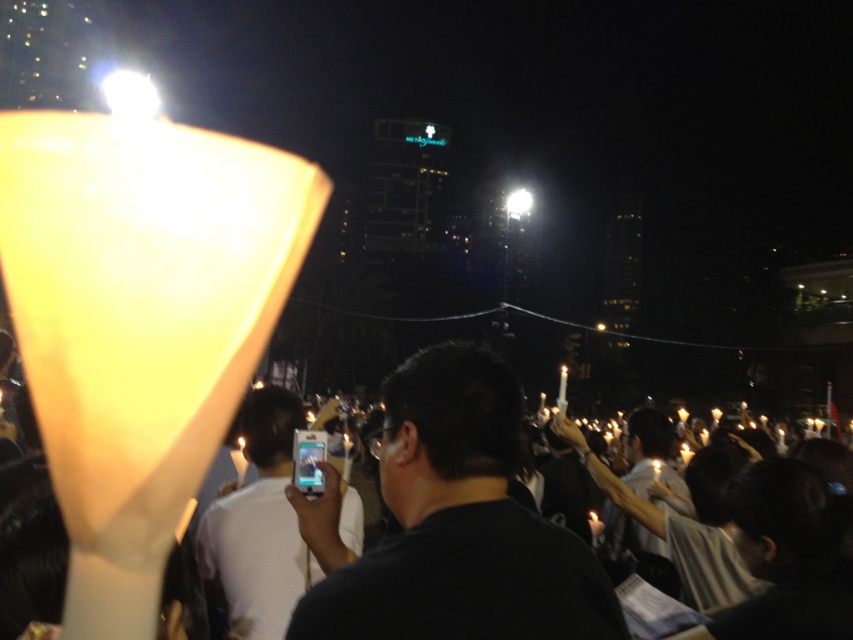
Who is higher up, black matte phone at center or white glossy phone at center?

black matte phone at center is above.

Is point (463, 353) positioned behind point (279, 480)?

No, (463, 353) is in front of (279, 480).

The image size is (853, 640). What do you see at coordinates (451, 524) in the screenshot?
I see `black matte phone at center` at bounding box center [451, 524].

Find the location of a particular element. This screenshot has height=640, width=853. black matte phone at center is located at coordinates (451, 524).

Can you confirm if matte white candle at center is positioned below black matte phone at center?

No, matte white candle at center is not below black matte phone at center.

What do you see at coordinates (459, 524) in the screenshot? I see `matte white candle at center` at bounding box center [459, 524].

Image resolution: width=853 pixels, height=640 pixels. Describe the element at coordinates (459, 524) in the screenshot. I see `matte white candle at center` at that location.

At what (x,y) coordinates should I click in order to perform the action: click on matte white candle at center. Please return your answer as a coordinate pair (x, y). The image size is (853, 640). Looking at the image, I should click on (459, 524).

You are a GUI agent. You are given a task and a screenshot of the screen. Output one action in this format:
    pyautogui.click(x=<x>, y=<y>)
    Task: Click on the matte white candle at center
    
    Given the screenshot: What is the action you would take?
    coord(459,524)

Who is lower down, matte white candle at center or white glossy phone at center?

white glossy phone at center is lower down.

Between point (492, 544) and point (350, 525), which one is positioned behind?

Point (350, 525)

This screenshot has width=853, height=640. Find the location of `matte white candle at center`. matte white candle at center is located at coordinates (459, 524).